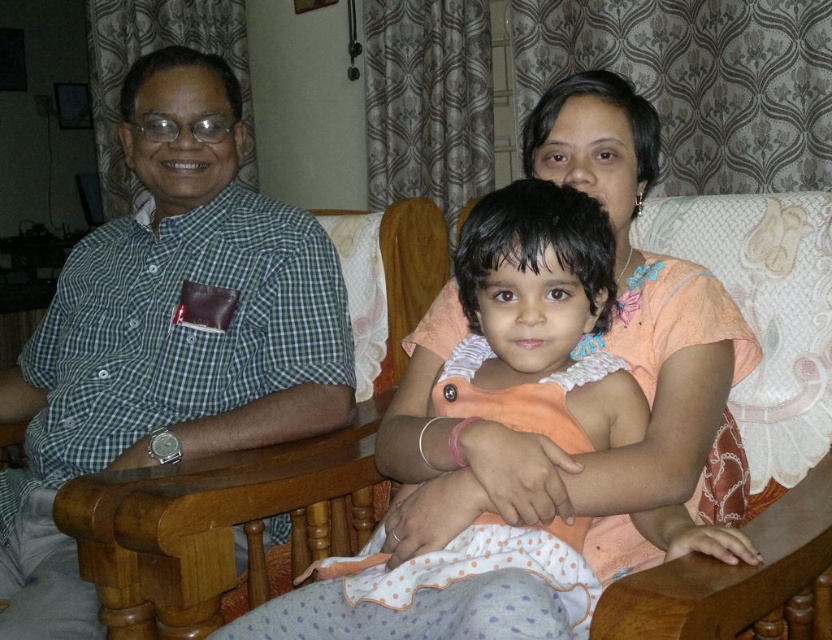
You are a photographer setting up a photo shoot in the living room. You need to position a camera on the coffee table so that both the green checkered shirt at left and the light orange fabric dress at center are visible in the frame. Given their heights, which object should you focus on to ensure both are in focus?

The green checkered shirt at left is taller than the light orange fabric dress at center, so focusing on the green checkered shirt at left will ensure both are in focus.

You are a photographer setting up for a family photo. You notice the green checkered shirt at left and the light orange fabric dress at center. Which clothing item has a larger width when viewed from your position?

The green checkered shirt at left has a larger width than the light orange fabric dress at center.